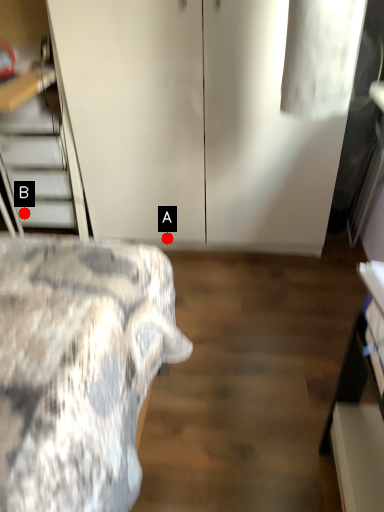
Question: Two points are circled on the image, labeled by A and B beside each circle. Which point appears closest to the camera in this image?

Choices:
 (A) A is closer
 (B) B is closer

Answer: (A)